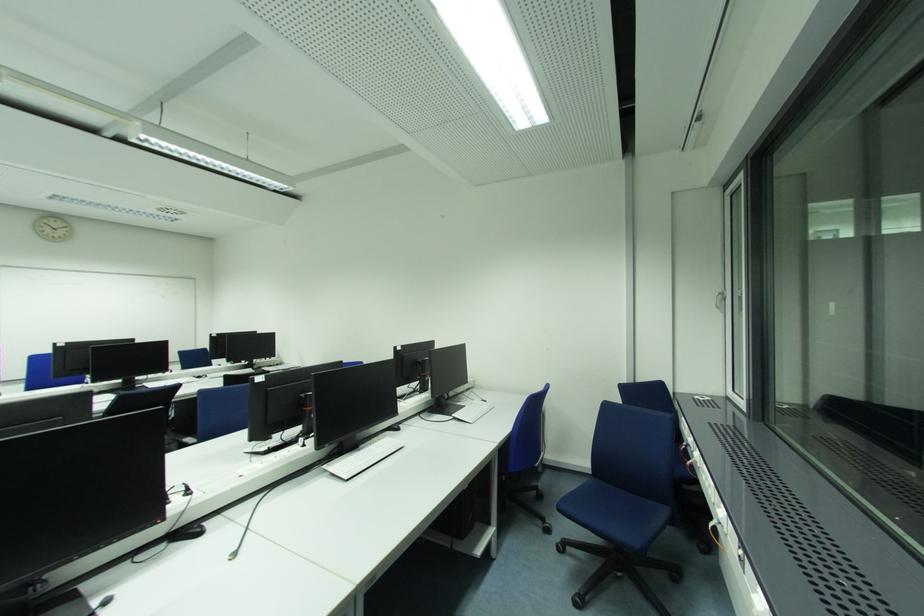
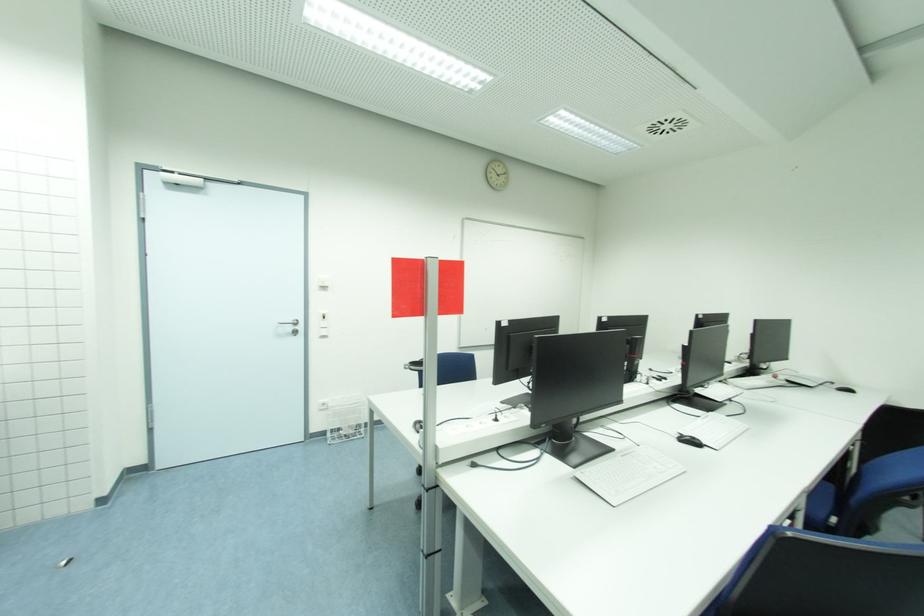
Question: What movement of the cameraman would produce the second image?

Choices:
 (A) Left
 (B) Right
 (C) Forward
 (D) Backward

Answer: (A)